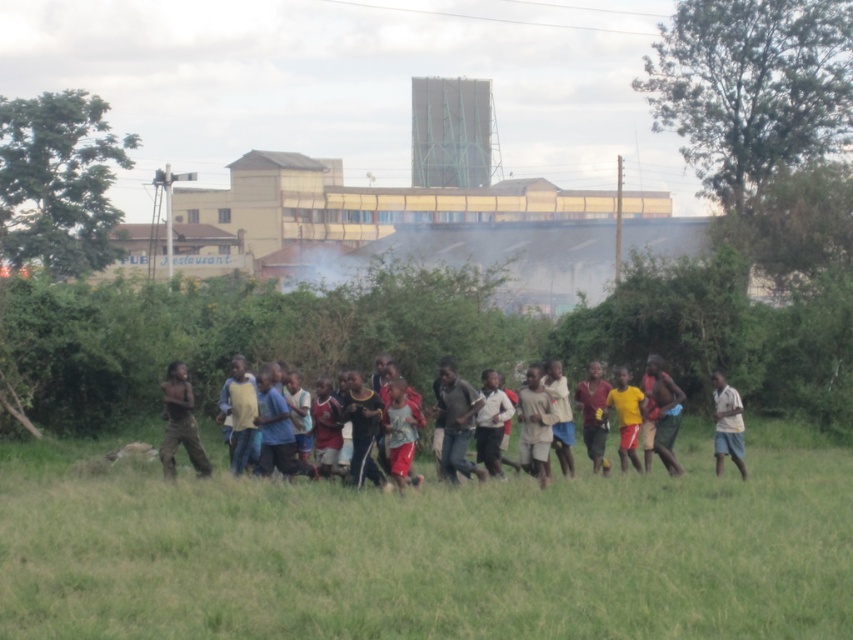
You are a photographer trying to capture a photo of the children playing. You want to ensure the dark brown pants at left are visible above the green grass at center. Based on the scene, is this possible?

The green grass at center is below the dark brown pants at left, so yes, the dark brown pants at left will be visible above the green grass at center in the photo.

You are a drone operator trying to capture a photo of the children running in the grass. The camera is currently focused on the green grass at center. According to the coordinates provided, is the camera positioned correctly to capture the children?

The green grass at center is located at coordinates point (431, 552), so the camera is positioned correctly to capture the children running in the grass.